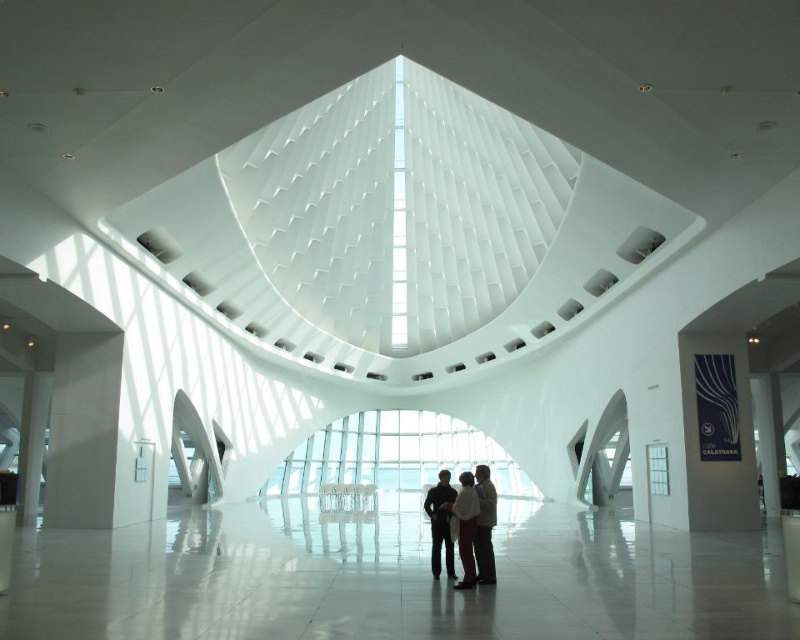
Is white fabric coat at center positioned before light beige fabric coat at center?

Yes, white fabric coat at center is closer to the viewer.

Can you confirm if white fabric coat at center is positioned below light beige fabric coat at center?

Indeed, white fabric coat at center is positioned under light beige fabric coat at center.

What do you see at coordinates (466, 528) in the screenshot?
I see `white fabric coat at center` at bounding box center [466, 528].

The width and height of the screenshot is (800, 640). Identify the location of white fabric coat at center. (466, 528).

Does dark blue fabric jacket at center appear over white fabric coat at center?

Incorrect, dark blue fabric jacket at center is not positioned above white fabric coat at center.

Between point (428, 500) and point (458, 540), which one is positioned in front?

Point (458, 540) is more forward.

Is point (440, 570) positioned after point (466, 518)?

Yes, point (440, 570) is behind point (466, 518).

Locate an element on the screen. The image size is (800, 640). dark blue fabric jacket at center is located at coordinates (440, 522).

Is dark blue fabric jacket at center thinner than light beige fabric coat at center?

Yes, dark blue fabric jacket at center is thinner than light beige fabric coat at center.

Is dark blue fabric jacket at center above light beige fabric coat at center?

Incorrect, dark blue fabric jacket at center is not positioned above light beige fabric coat at center.

Identify the location of dark blue fabric jacket at center. (440, 522).